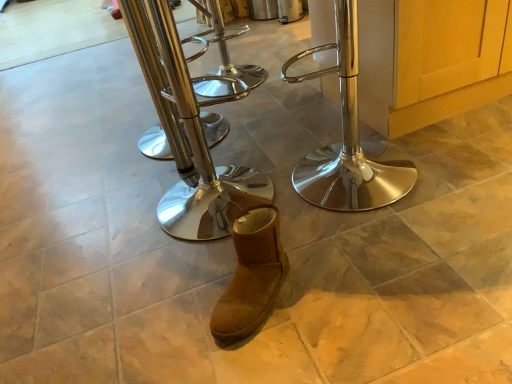
In order to click on vacant space situated on the left part of polished metal bar stool at center, the third step stool viewed from the right in this screenshot , I will do `click(95, 153)`.